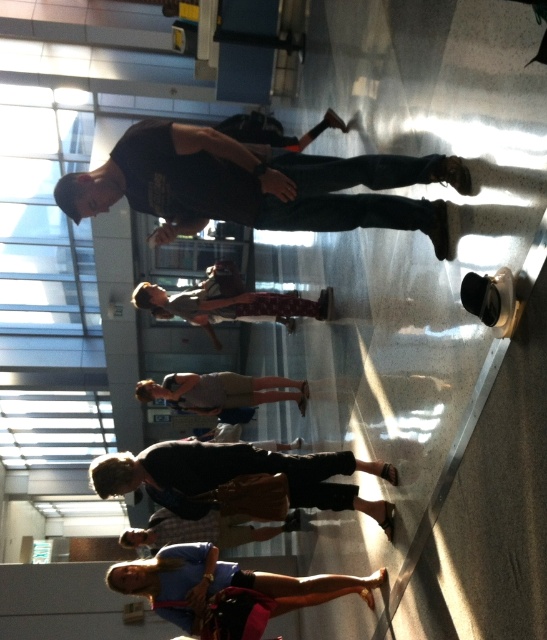
Between dark gray fabric skater at center and denim shorts at lower center, which one appears on the right side from the viewer's perspective?

From the viewer's perspective, dark gray fabric skater at center appears more on the right side.

Between dark gray fabric skater at center and denim shorts at lower center, which one is positioned lower?

denim shorts at lower center is below.

Does point (299, 480) lie in front of point (337, 593)?

That is True.

I want to click on dark gray fabric skater at center, so click(237, 476).

Between dark blue jeans at center and dark gray fabric skater at center, which one has less height?

Standing shorter between the two is dark gray fabric skater at center.

Is dark blue jeans at center to the right of dark gray fabric skater at center from the viewer's perspective?

Yes, dark blue jeans at center is to the right of dark gray fabric skater at center.

You are a GUI agent. You are given a task and a screenshot of the screen. Output one action in this format:
    pyautogui.click(x=<x>, y=<y>)
    Task: Click on the dark blue jeans at center
    The height and width of the screenshot is (640, 547).
    Given the screenshot: What is the action you would take?
    pyautogui.click(x=257, y=186)

Identify the location of dark blue jeans at center. The image size is (547, 640). pos(257,186).

Can you confirm if dark blue jeans at center is positioned above denim shorts at lower center?

Correct, dark blue jeans at center is located above denim shorts at lower center.

Can you confirm if dark blue jeans at center is shorter than denim shorts at lower center?

Incorrect, dark blue jeans at center's height does not fall short of denim shorts at lower center's.

Does point (199, 221) come behind point (189, 570)?

No.

This screenshot has width=547, height=640. I want to click on dark blue jeans at center, so click(x=257, y=186).